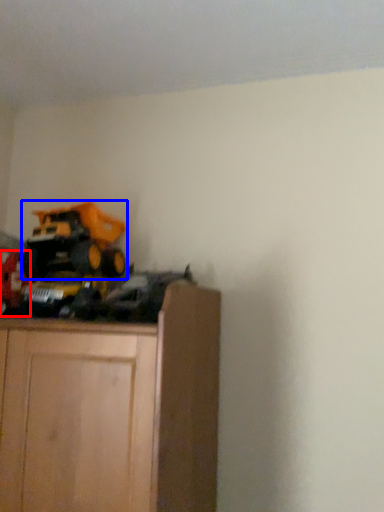
Question: Among these objects, which one is nearest to the camera, toy (highlighted by a red box) or equipment (highlighted by a blue box)?

Choices:
 (A) toy
 (B) equipment

Answer: (A)